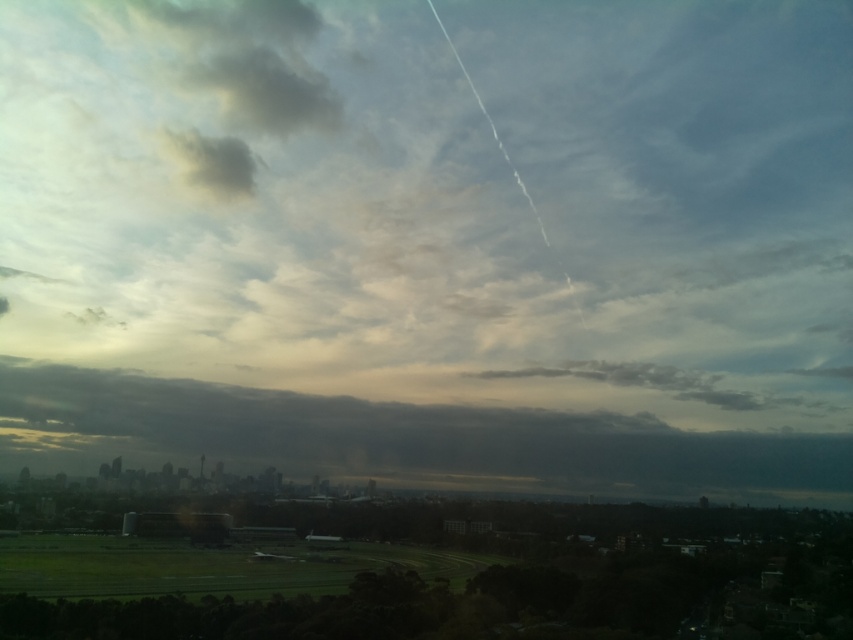
Question: Is dark gray cloud at center below dark gray cloud at upper left?

Choices:
 (A) no
 (B) yes

Answer: (B)

Question: Is dark gray cloud at center below dark gray cloud at upper left?

Choices:
 (A) no
 (B) yes

Answer: (B)

Question: Which object is closer to the camera taking this photo?

Choices:
 (A) dark gray cloud at upper left
 (B) dark gray cloud at center

Answer: (B)

Question: Does dark gray cloud at center lie behind dark gray cloud at upper left?

Choices:
 (A) yes
 (B) no

Answer: (B)

Question: Among these objects, which one is farthest from the camera?

Choices:
 (A) dark gray cloud at upper left
 (B) dark gray cloud at center

Answer: (A)